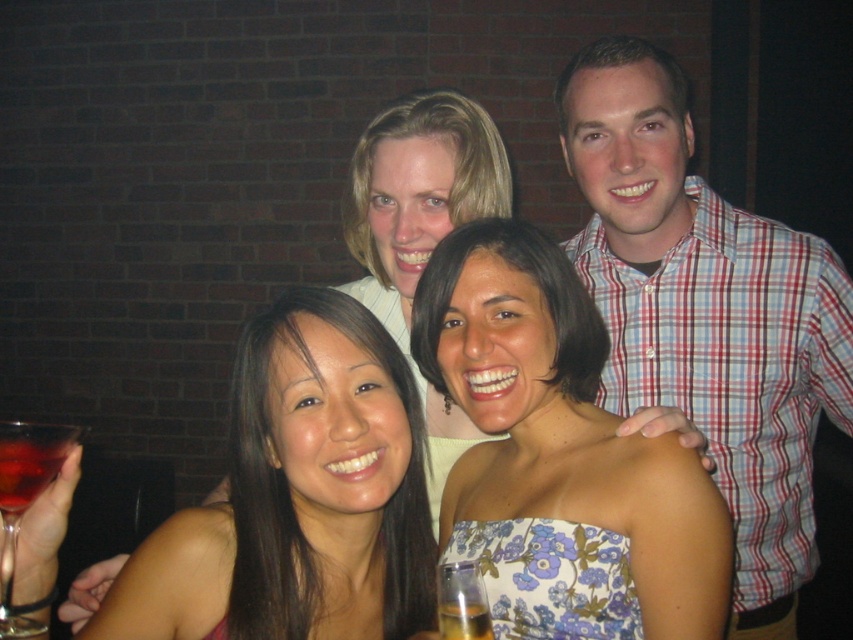
You are a photographer trying to capture a closeup shot of the floral print dress at center and the translucent glass wine at lower left. Which object should you zoom in on to ensure it fits entirely within your camera frame without cropping?

The floral print dress at center is wider than the translucent glass wine at lower left, so you should zoom in on the translucent glass wine at lower left to ensure it fits entirely within the camera frame without cropping.

You are a photographer trying to capture a closeup shot of the floral print dress at center. Given that your camera has a focus range of 0.6 to 0.7 on the x and y axes, will the dress be within the focus range?

The floral print dress at center is positioned at point (560, 456). Since the x coordinate 0.713 is within the 0.6 to 0.7 range and the y coordinate 0.658 is within the 0.6 to 0.7 range, the dress is within the focus range.

You are standing in a room and see the plaid shirt at upper right. If you want to grab a drink from a table that is 5 feet away from you, will you be able to reach the table without moving closer to it?

The plaid shirt at upper right and viewer are 4.71 feet apart from each other. Since the table is 5 feet away, you are slightly too far to reach it without moving closer.